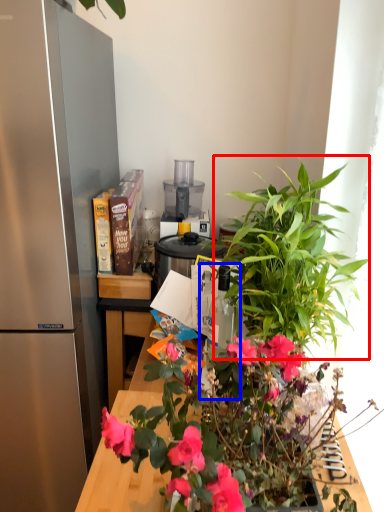
Question: Which point is closer to the camera, vegetation (highlighted by a red box) or bottle (highlighted by a blue box)?

Choices:
 (A) vegetation
 (B) bottle

Answer: (A)